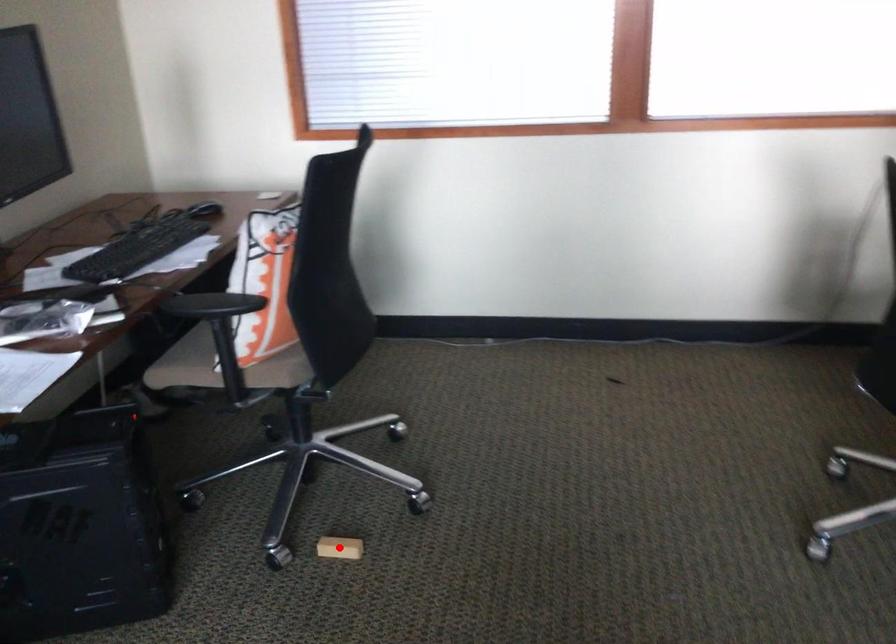
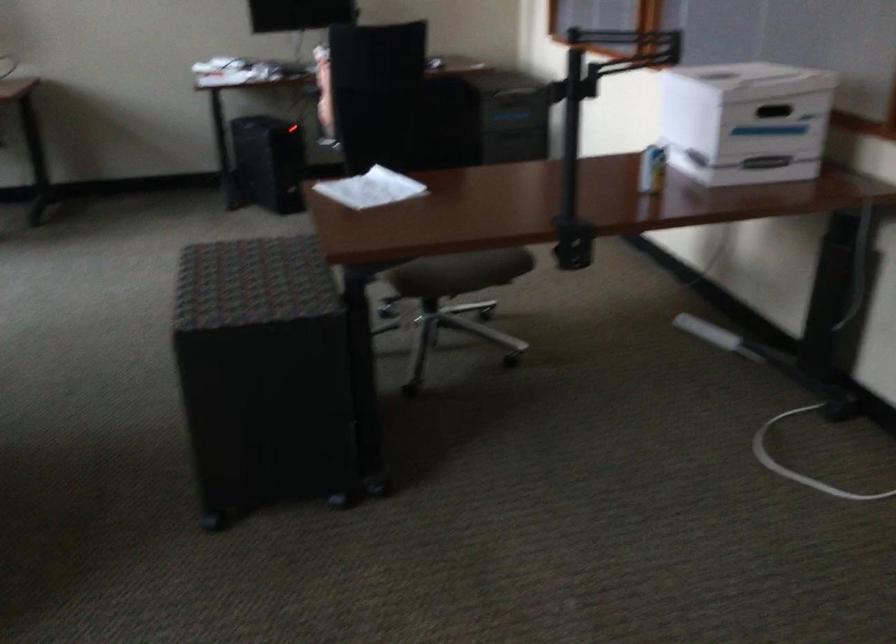
Question: I am providing you with two images of the same scene from different viewpoints. A red point is marked on the first image. Can you still see the location of the red point in image 2?

Choices:
 (A) Yes
 (B) No

Answer: (B)